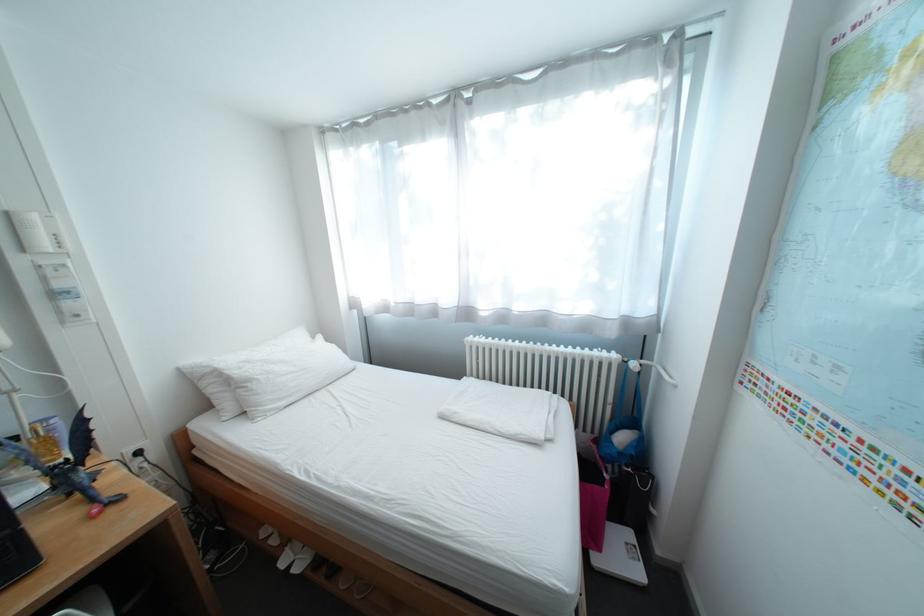
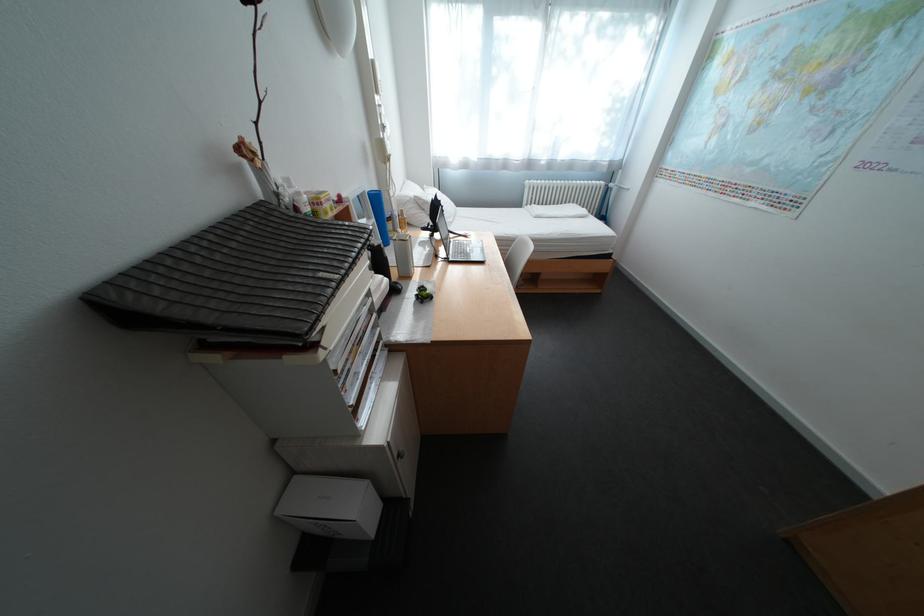
Locate, in the second image, the point that corresponds to [221,371] in the first image.

(420, 200)